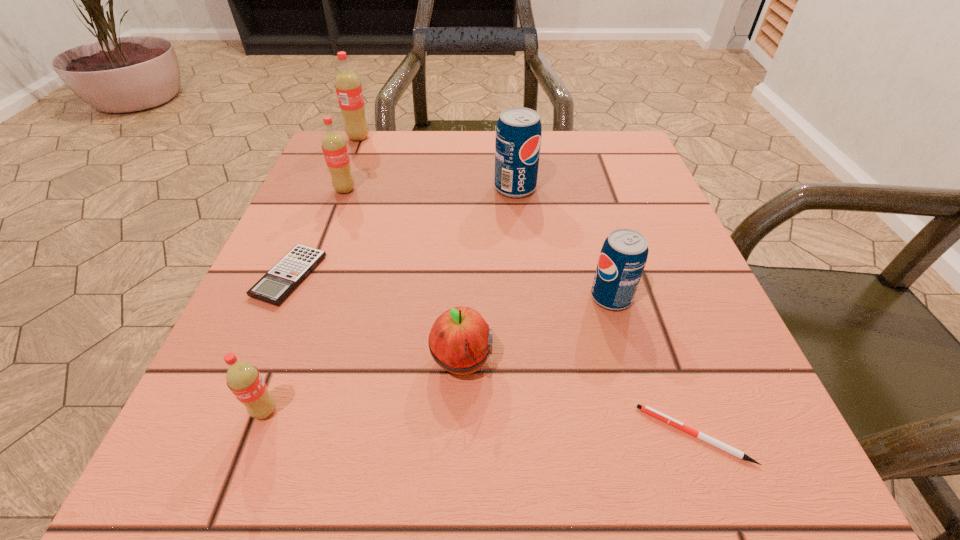
I want to click on red soda that is the closest to the second biggest red soda, so [x=349, y=92].

Select which red soda appears as the second closest to the nearest red soda. Please provide its 2D coordinates. Your answer should be formatted as a tuple, i.e. [(x, y)], where the tuple contains the x and y coordinates of a point satisfying the conditions above.

[(349, 92)]